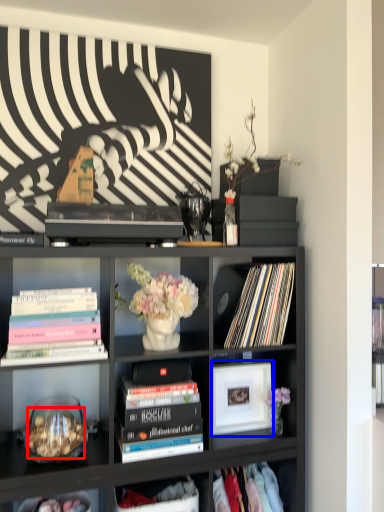
Question: Among these objects, which one is nearest to the camera, food (highlighted by a red box) or picture frame (highlighted by a blue box)?

Choices:
 (A) food
 (B) picture frame

Answer: (A)